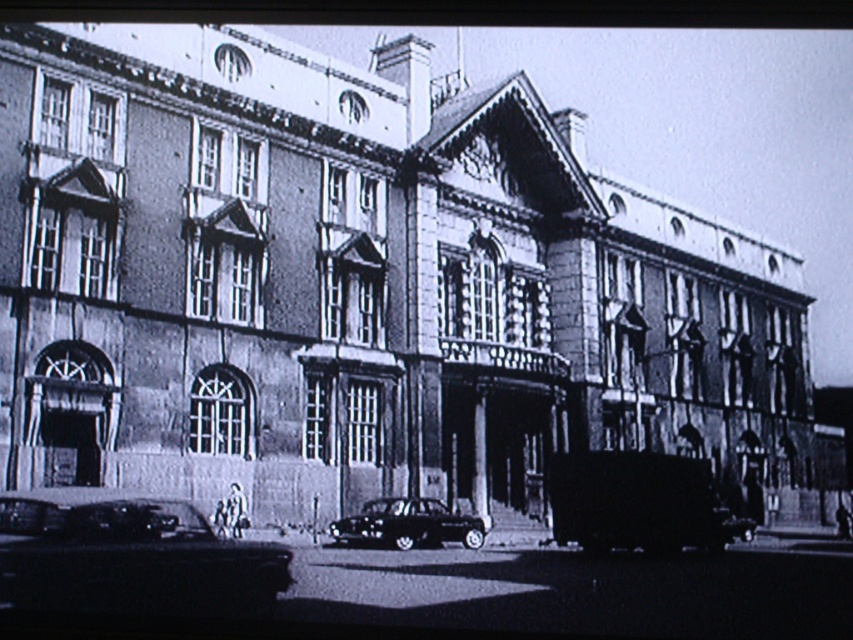
You are a photographer planning to take a photo of the grand historic building. You notice two shiny black cars in the foreground. Which car, the shiny black car at lower left or the shiny black car at center, would appear closer to the camera if both are in the same frame?

The shiny black car at lower left appears closer to the camera because it is larger in size than the shiny black car at center.

You are standing in front of the grand historic building and see a shiny black car at lower left. There is a point at coordinate [131,557]. Is this point on the car?

Yes, the point at coordinate [131,557] is on the shiny black car at lower left according to the description.

You are a photographer standing at the entrance of the grand historic building. You want to take a photo of the building without any vehicles in the frame. Is the shiny black car at lower left blocking your shot? Please explain based on its position.

The shiny black car at lower left is located at point coordinates of 0.872 on the x axis and 0.154 on the y axis. Since the photographer is at the entrance, the car is positioned far to the right and lower part of the frame, so it should not block the view of the building. Therefore, the car is not obstructing the shot.